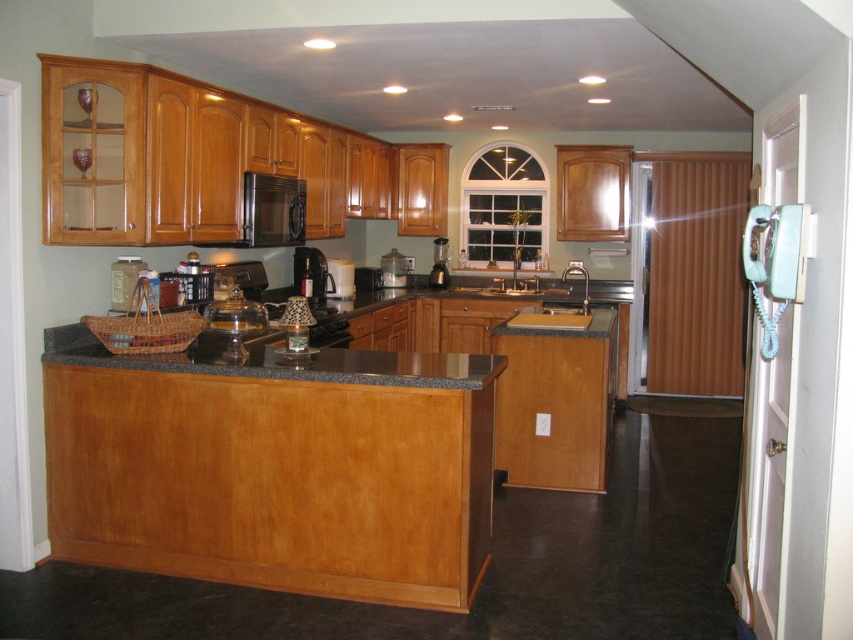
Can you confirm if satin black microwave at upper center is positioned below metallic silver coffee maker at center?

Incorrect, satin black microwave at upper center is not positioned below metallic silver coffee maker at center.

Can you confirm if satin black microwave at upper center is thinner than metallic silver coffee maker at center?

No.

This screenshot has height=640, width=853. In order to click on satin black microwave at upper center in this screenshot , I will do `click(273, 209)`.

Find the location of `satin black microwave at upper center`. satin black microwave at upper center is located at coordinates (273, 209).

Can you confirm if black plastic coffee machine at center is shorter than white plastic blender at center?

No, black plastic coffee machine at center is not shorter than white plastic blender at center.

Does black plastic coffee machine at center come behind white plastic blender at center?

No.

Between point (302, 278) and point (328, 288), which one is positioned behind?

The point (328, 288) is behind.

At what (x,y) coordinates should I click in order to perform the action: click on black plastic coffee machine at center. Please return your answer as a coordinate pair (x, y). Looking at the image, I should click on click(309, 272).

Which is more to the right, satin black microwave at upper center or black plastic coffee machine at center?

Positioned to the right is black plastic coffee machine at center.

Which of these two, satin black microwave at upper center or black plastic coffee machine at center, stands shorter?

With less height is black plastic coffee machine at center.

This screenshot has width=853, height=640. Identify the location of satin black microwave at upper center. (273, 209).